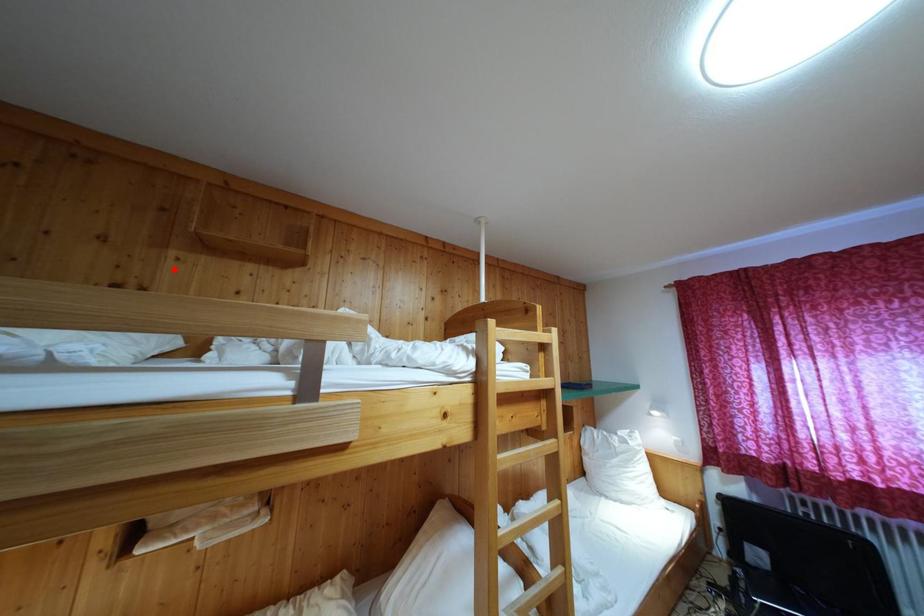
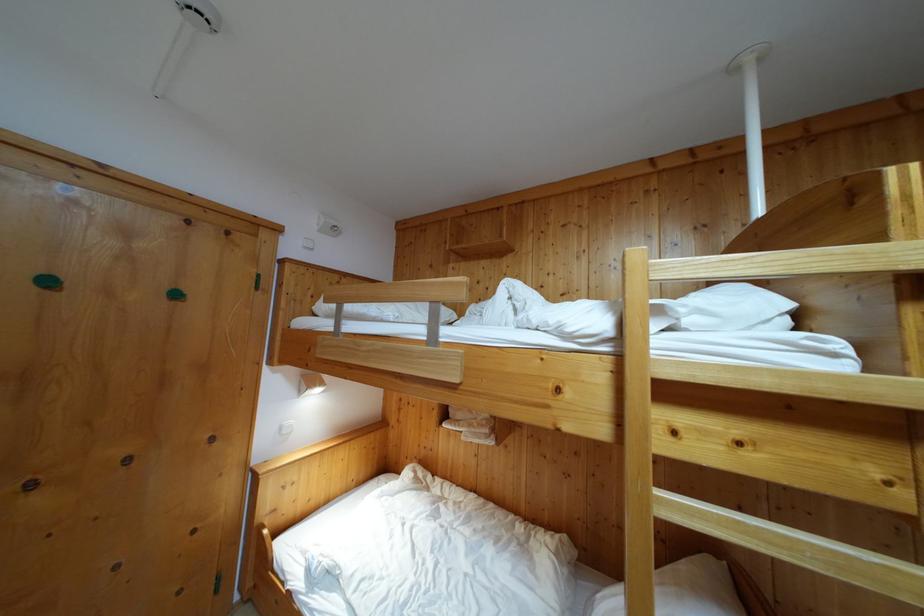
Question: I am providing you with two images of the same scene from different viewpoints. A red point is shown in image1. For the corresponding object point in image2, is it positioned nearer or farther from the camera?

Choices:
 (A) Nearer
 (B) Farther

Answer: (A)